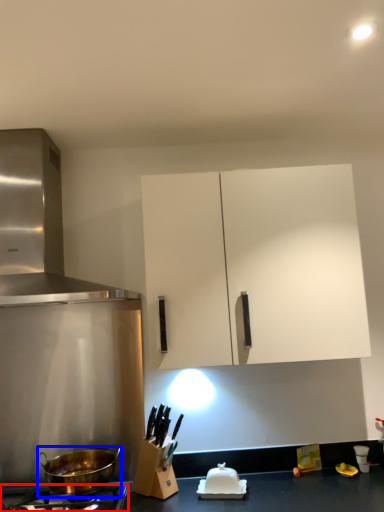
Question: Which object is closer to the camera taking this photo, gas stove (highlighted by a red box) or wok (highlighted by a blue box)?

Choices:
 (A) gas stove
 (B) wok

Answer: (A)